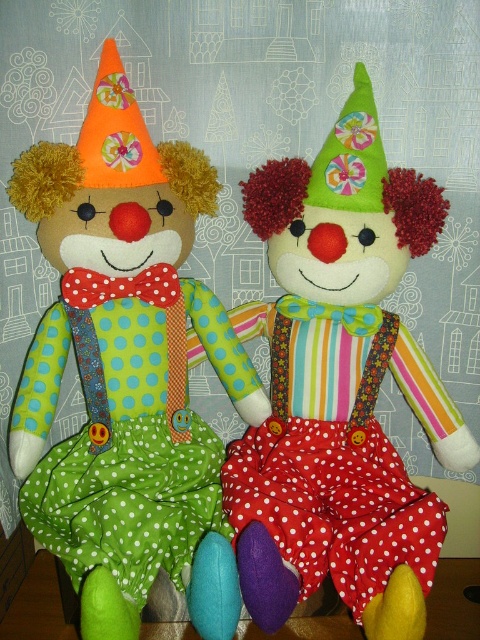
Question: Can you confirm if matte fabric clown at left is smaller than matte green fabric clown at center?

Choices:
 (A) yes
 (B) no

Answer: (B)

Question: Among these points, which one is farthest from the camera?

Choices:
 (A) (274, 582)
 (B) (156, 177)

Answer: (B)

Question: Is matte fabric clown at left to the right of matte green fabric clown at center from the viewer's perspective?

Choices:
 (A) no
 (B) yes

Answer: (A)

Question: Is matte fabric clown at left behind matte green fabric clown at center?

Choices:
 (A) yes
 (B) no

Answer: (B)

Question: Which object appears farthest from the camera in this image?

Choices:
 (A) matte green fabric clown at center
 (B) matte fabric clown at left

Answer: (A)